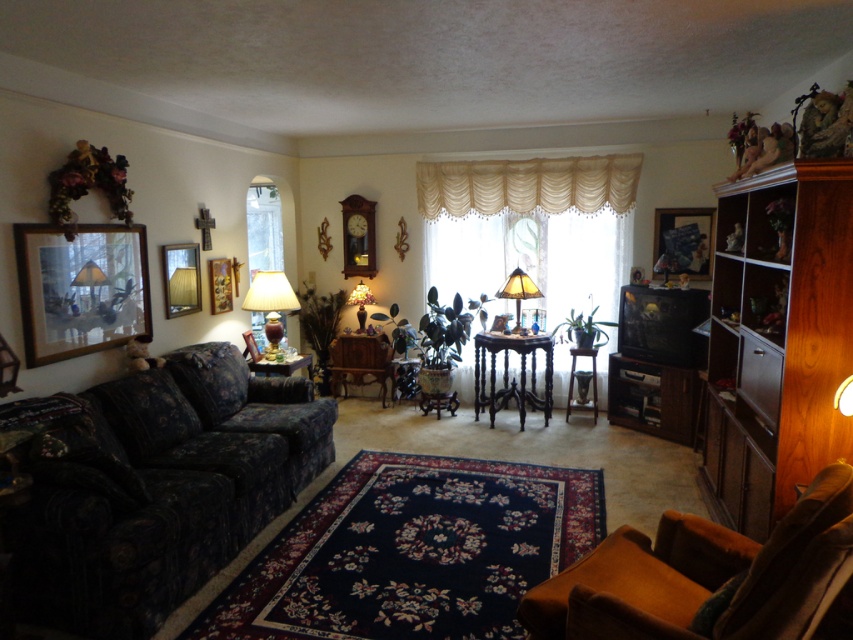
Question: Which is nearer to the wooden chair at center?

Choices:
 (A) tinted glass lamp at center
 (B) matte floral-patterned lampshade at center
 (C) matte glass picture frame at upper left

Answer: (B)

Question: Among these objects, which one is farthest from the camera?

Choices:
 (A) dark wood table at center
 (B) wooden picture frame at upper left
 (C) matte glass picture frame at upper left
 (D) matte brown lamp at center

Answer: (A)

Question: Which of the following is the farthest from the observer?

Choices:
 (A) wooden chair at center
 (B) brown suede armchair at lower right
 (C) matte glass picture frame at upper left

Answer: (A)

Question: Considering the relative positions of matte brown lamp at center and wooden table at center in the image provided, where is matte brown lamp at center located with respect to wooden table at center?

Choices:
 (A) left
 (B) right

Answer: (A)

Question: Can you confirm if brown suede armchair at lower right is wider than matte brown lamp at center?

Choices:
 (A) yes
 (B) no

Answer: (A)

Question: Considering the relative positions of tinted glass lamp at center and matte floral-patterned lampshade at center in the image provided, where is tinted glass lamp at center located with respect to matte floral-patterned lampshade at center?

Choices:
 (A) above
 (B) below

Answer: (B)